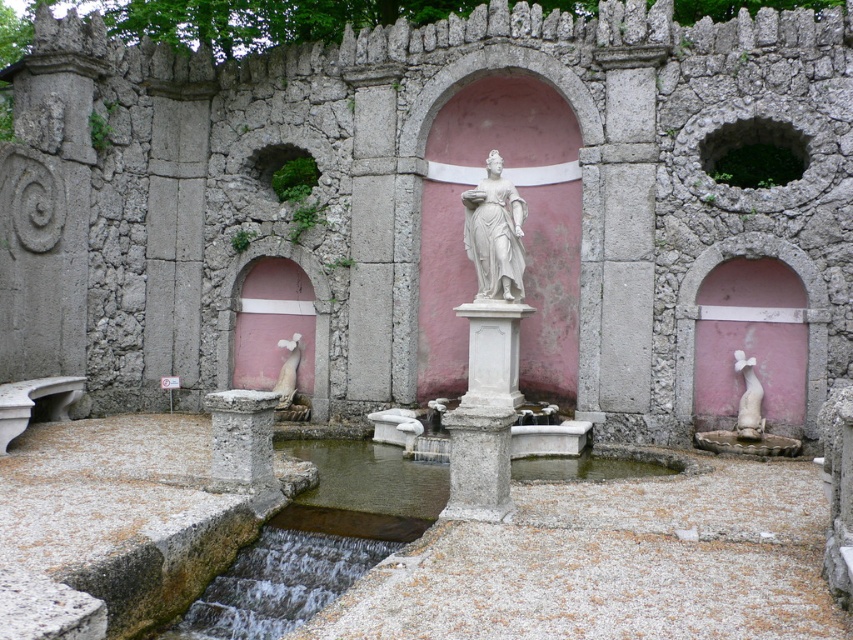
Question: Estimate the real-world distances between objects in this image. Which object is farther from the white marble fountain at lower right?

Choices:
 (A) white marble statue at center
 (B) white marble statue at lower right

Answer: (A)

Question: In this image, where is gray stone pillar at center located relative to white marble dog at center?

Choices:
 (A) below
 (B) above

Answer: (A)

Question: Does gray stone pillar at center have a larger size compared to white marble fountain at lower right?

Choices:
 (A) no
 (B) yes

Answer: (B)

Question: Which object is closer to the camera taking this photo?

Choices:
 (A) white marble fountain at lower right
 (B) white stone pillar at center
 (C) white marble dog at center
 (D) white marble statue at center

Answer: (B)

Question: Does gray stone pillar at center appear under white marble fountain at lower right?

Choices:
 (A) no
 (B) yes

Answer: (A)

Question: Which point is farther to the camera?

Choices:
 (A) white marble statue at center
 (B) white marble dog at center
 (C) white marble statue at lower right
 (D) white marble fountain at lower right

Answer: (B)